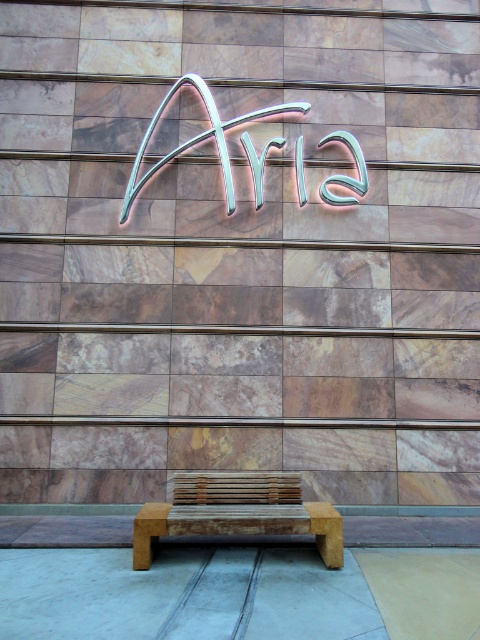
Between rustic wood bench at center and metallic neon sign at center, which one appears on the left side from the viewer's perspective?

From the viewer's perspective, rustic wood bench at center appears more on the left side.

Is rustic wood bench at center positioned at the back of metallic neon sign at center?

No.

Which is in front, point (230, 525) or point (123, 196)?

Point (230, 525) is in front.

The image size is (480, 640). What are the coordinates of `rustic wood bench at center` in the screenshot? It's located at (238, 513).